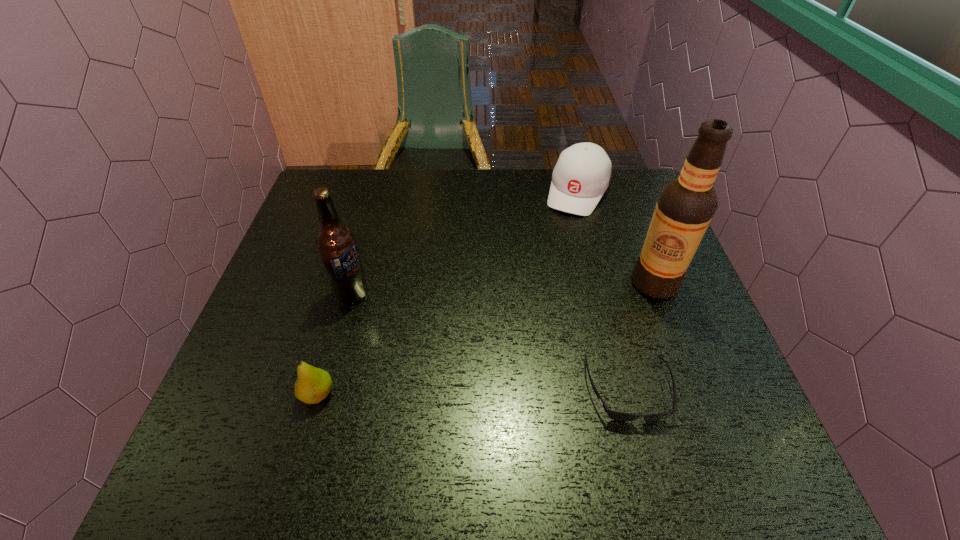
I want to click on vacant space on the desktop that is between the pear and the sunglasses and is positioned on the front-facing side of the baseball cap, so click(480, 393).

Where is `vacant spot on the desktop that is between the pear and the sunglasses and is positioned on the label of the tallest object`? This screenshot has width=960, height=540. vacant spot on the desktop that is between the pear and the sunglasses and is positioned on the label of the tallest object is located at coordinates (462, 393).

Where is `vacant spot on the desktop that is between the pear and the sunglasses and is positioned on the label of the beer bottle`? This screenshot has height=540, width=960. vacant spot on the desktop that is between the pear and the sunglasses and is positioned on the label of the beer bottle is located at coordinates (483, 393).